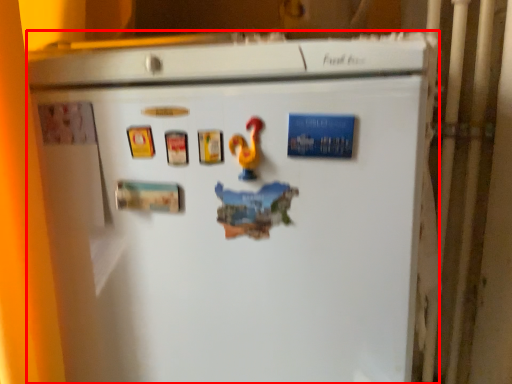
Question: Where is refrigerator (annotated by the red box) located in relation to toy in the image?

Choices:
 (A) right
 (B) left

Answer: (B)